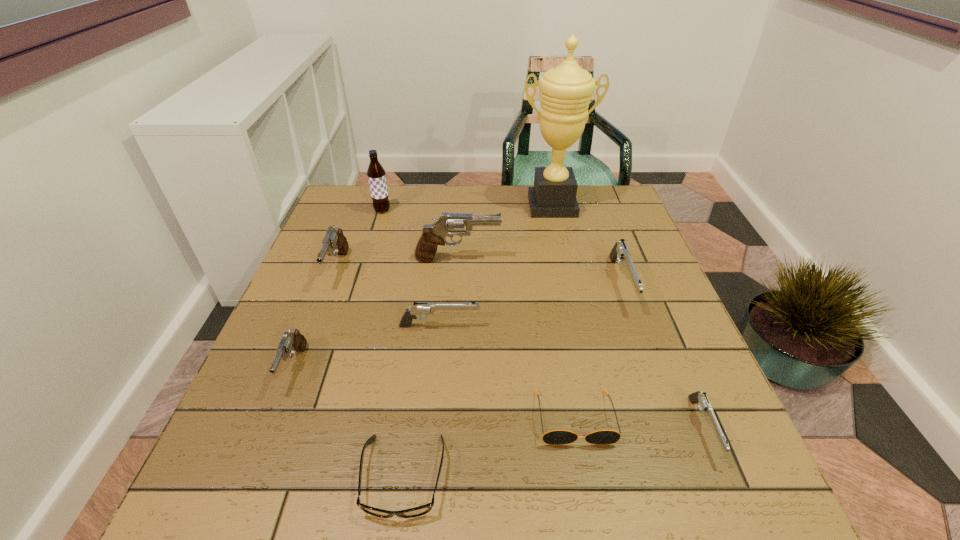
This screenshot has height=540, width=960. In order to click on empty location between the second farthest silver pistol and the black sunglasses in this screenshot , I will do `click(507, 372)`.

At what (x,y) coordinates should I click in order to perform the action: click on vacant space in between the spectacles and the third object from left to right. Please return your answer as a coordinate pair (x, y). This screenshot has height=540, width=960. Looking at the image, I should click on [x=393, y=343].

Where is `free space that is in between the smallest gray pistol and the brown root beer`? This screenshot has width=960, height=540. free space that is in between the smallest gray pistol and the brown root beer is located at coordinates (339, 289).

Where is `free spot between the biggest gray pistol and the second biggest silver pistol`? The height and width of the screenshot is (540, 960). free spot between the biggest gray pistol and the second biggest silver pistol is located at coordinates (448, 293).

Locate an element on the screen. The image size is (960, 540). free space between the second shortest pistol and the ninth object from left to right is located at coordinates (531, 305).

Image resolution: width=960 pixels, height=540 pixels. I want to click on free spot between the nearest gray pistol and the rightmost object, so click(499, 397).

Locate an element on the screen. empty location between the sunglasses and the yellow trophy cup is located at coordinates (564, 312).

Where is `empty space that is in between the fourth shortest object and the nearest gray pistol`? The width and height of the screenshot is (960, 540). empty space that is in between the fourth shortest object and the nearest gray pistol is located at coordinates (367, 347).

Find the location of `free spot between the black sunglasses and the rightmost pistol`. free spot between the black sunglasses and the rightmost pistol is located at coordinates (638, 423).

Identify the location of unoccupied area between the leftmost silver pistol and the black sunglasses. (507, 372).